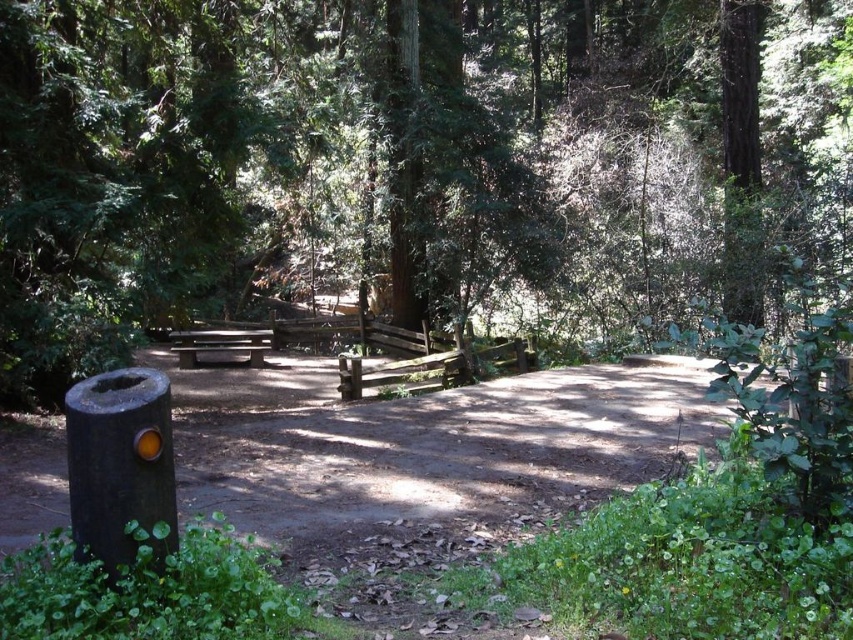
Based on the photo, is brown wood tree at center bigger than smooth brown picnic table at center?

Yes.

Which is behind, point (312, 102) or point (257, 360)?

The point (257, 360) is behind.

Does point (747, 188) lie behind point (260, 364)?

Yes, point (747, 188) is behind point (260, 364).

The image size is (853, 640). Find the location of `brown wood tree at center`. brown wood tree at center is located at coordinates (407, 164).

Can you confirm if black matte post at lower left is shorter than smooth brown picnic table at center?

Incorrect, black matte post at lower left's height does not fall short of smooth brown picnic table at center's.

Is point (287, 392) positioned before point (201, 346)?

Yes.

You are a GUI agent. You are given a task and a screenshot of the screen. Output one action in this format:
    pyautogui.click(x=<x>, y=<y>)
    Task: Click on the black matte post at lower left
    The width and height of the screenshot is (853, 640).
    Given the screenshot: What is the action you would take?
    pyautogui.click(x=428, y=444)

Can you confirm if brown wood tree at center is thinner than black matte post at lower left?

No.

Does brown wood tree at center appear under black matte post at lower left?

Actually, brown wood tree at center is above black matte post at lower left.

From the picture: Who is more distant from viewer, (572, 180) or (395, 406)?

Positioned behind is point (572, 180).

Where is `brown wood tree at center`? brown wood tree at center is located at coordinates 407,164.